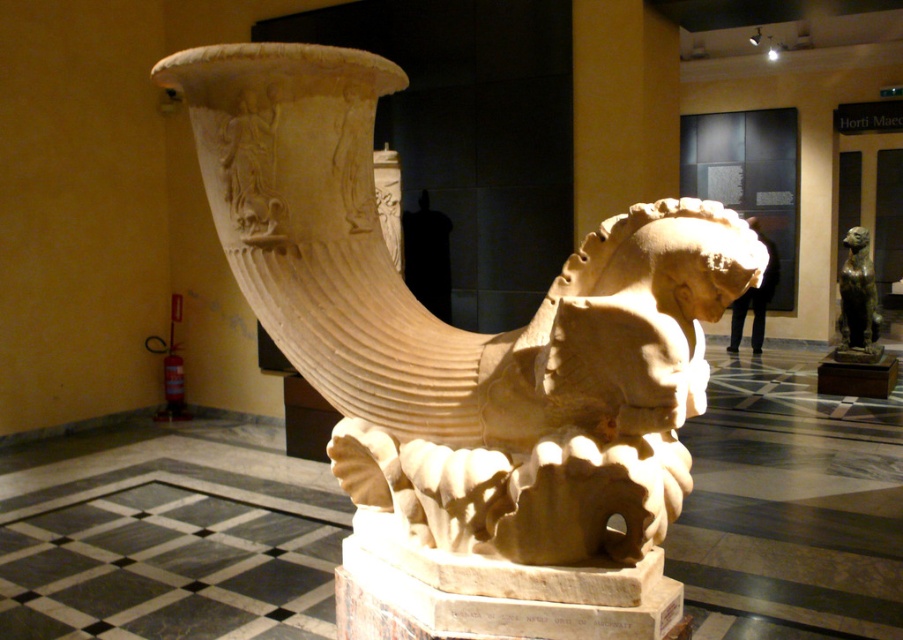
You are a museum visitor carrying a 1.5 meter long measuring tape. You want to measure the distance between the beige stone vase at center and the bronze statue at right. Can you do it with the tape you have?

The distance between the beige stone vase at center and the bronze statue at right is 6.63 meters. Since your measuring tape is only 1.5 meters long, it is not long enough to measure the distance between them.

You are a museum visitor standing in front of the beige stone vase at center and the bronze statue at right. Which object is located higher up in the image?

The bronze statue at right is located higher up than the beige stone vase at center because the beige stone vase at center is positioned under it.

You are standing in front of the stone sculpture in the museum. You notice two points marked on the sculpture. The first point is at coordinates point (334,323) and the second point is at point (871,300). Which point is closer to your eyes?

Point (334,323) is closer to the viewer than point (871,300).